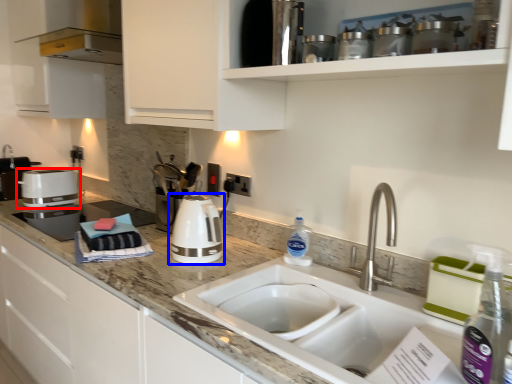
Question: Among these objects, which one is farthest to the camera, kitchen appliance (highlighted by a red box) or home appliance (highlighted by a blue box)?

Choices:
 (A) kitchen appliance
 (B) home appliance

Answer: (A)